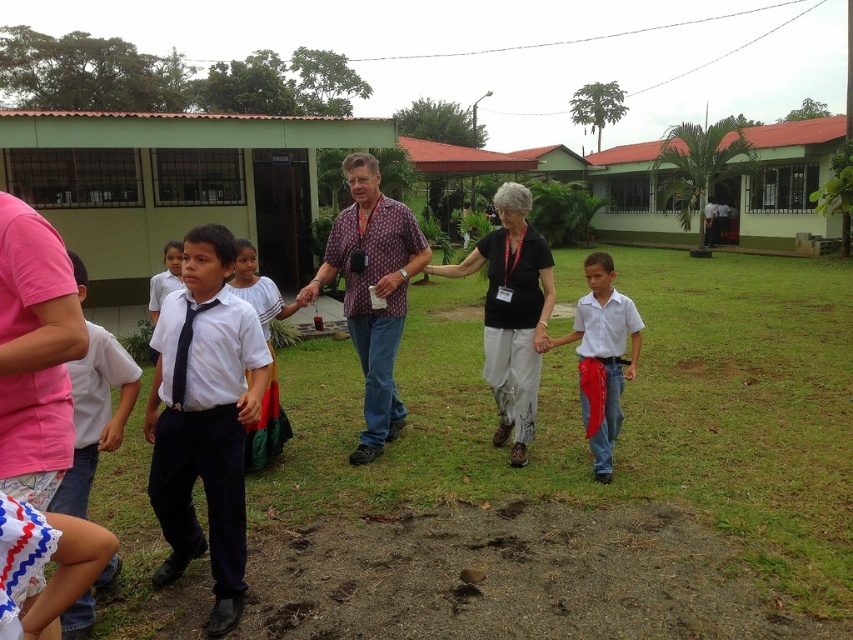
Question: Which of these objects is positioned closest to the white cotton shirt at center?

Choices:
 (A) white glossy uniform at center
 (B) white cotton shirt at left
 (C) white glossy shirt at center

Answer: (A)

Question: Which point appears closest to the camera in this image?

Choices:
 (A) (271, 291)
 (B) (119, 513)
 (C) (68, 618)

Answer: (C)

Question: Estimate the real-world distances between objects in this image. Which object is closer to the white cotton shirt at center?

Choices:
 (A) dark blue uniform at center
 (B) white glossy uniform at center
 (C) black cotton shirt at center

Answer: (B)

Question: Can you confirm if white glossy shirt at center is smaller than white uniform shirt at center?

Choices:
 (A) no
 (B) yes

Answer: (A)

Question: Is the position of black cotton shirt at center more distant than that of white cotton shirt at left?

Choices:
 (A) no
 (B) yes

Answer: (B)

Question: Is white glossy shirt at center bigger than white uniform shirt at center?

Choices:
 (A) no
 (B) yes

Answer: (B)